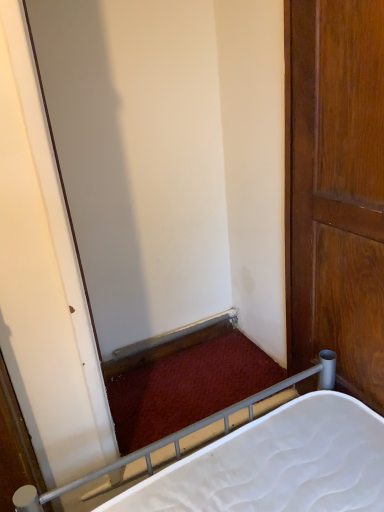
What do you see at coordinates (337, 188) in the screenshot? I see `wooden door at right` at bounding box center [337, 188].

Where is `wooden door at right`? The width and height of the screenshot is (384, 512). wooden door at right is located at coordinates (337, 188).

Identify the location of wooden door at right. The image size is (384, 512). (337, 188).